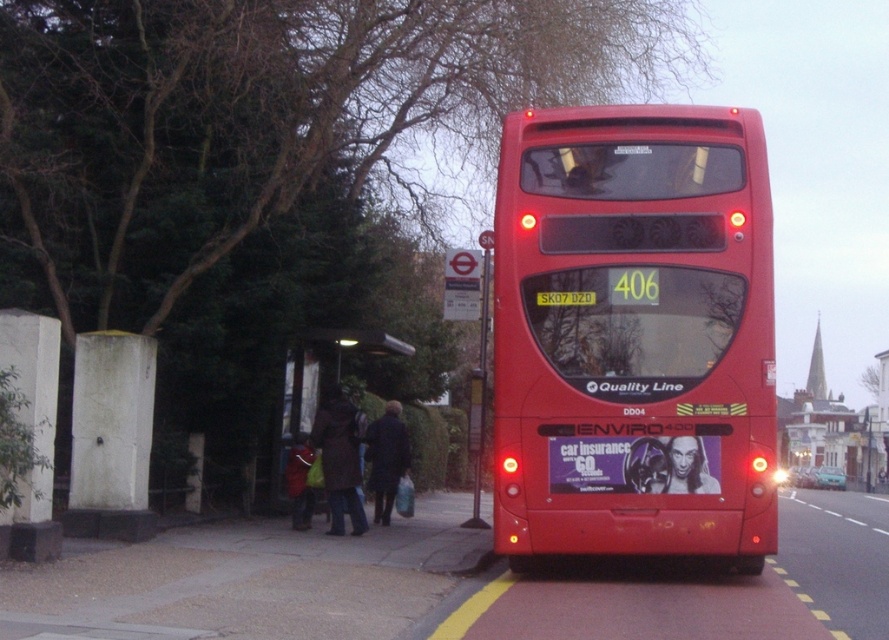
Is matte red bus at center shorter than dark brown wooden bench at center?

No, matte red bus at center is not shorter than dark brown wooden bench at center.

Is matte red bus at center taller than dark brown wooden bench at center?

Indeed, matte red bus at center has a greater height compared to dark brown wooden bench at center.

You are a GUI agent. You are given a task and a screenshot of the screen. Output one action in this format:
    pyautogui.click(x=<x>, y=<y>)
    Task: Click on the matte red bus at center
    Image resolution: width=889 pixels, height=640 pixels.
    Given the screenshot: What is the action you would take?
    pyautogui.click(x=633, y=333)